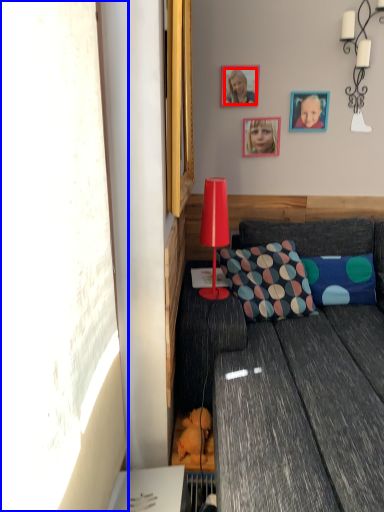
Question: Among these objects, which one is farthest to the camera, person (highlighted by a red box) or window screen (highlighted by a blue box)?

Choices:
 (A) person
 (B) window screen

Answer: (A)